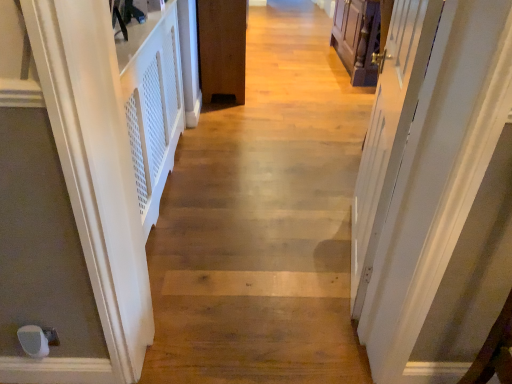
Question: Can you confirm if brown matte door at center, which appears as the second door when viewed from the front, is bigger than white matte door at left, marked as the second door in a back-to-front arrangement?

Choices:
 (A) yes
 (B) no

Answer: (A)

Question: Is the position of brown matte door at center, the first door positioned from the back, more distant than that of white matte door at left, the 2th door positioned from the right?

Choices:
 (A) yes
 (B) no

Answer: (A)

Question: From the image's perspective, is brown matte door at center, which appears as the second door when viewed from the front, under white matte door at left, the 1th door viewed from the left?

Choices:
 (A) no
 (B) yes

Answer: (A)

Question: Is brown matte door at center, the first door positioned from the back, next to white matte door at left, placed as the first door when sorted from front to back?

Choices:
 (A) no
 (B) yes

Answer: (A)

Question: Does brown matte door at center, the first door when ordered from right to left, have a greater width compared to white matte door at left, marked as the second door in a back-to-front arrangement?

Choices:
 (A) no
 (B) yes

Answer: (B)

Question: Is brown matte door at center, the first door positioned from the back, inside the boundaries of natural wood floor at center, or outside?

Choices:
 (A) inside
 (B) outside

Answer: (B)

Question: In terms of height, does brown matte door at center, the first door when ordered from right to left, look taller or shorter compared to natural wood floor at center?

Choices:
 (A) tall
 (B) short

Answer: (A)

Question: Is brown matte door at center, which appears as the second door when viewed from the front, to the left or to the right of natural wood floor at center in the image?

Choices:
 (A) right
 (B) left

Answer: (B)

Question: In the image, is brown matte door at center, the 2th door when ordered from left to right, positioned in front of or behind natural wood floor at center?

Choices:
 (A) front
 (B) behind

Answer: (B)

Question: Is white glossy door at right inside or outside of brown matte door at center, the 2th door when ordered from left to right?

Choices:
 (A) inside
 (B) outside

Answer: (B)

Question: In the image, is white glossy door at right on the left side or the right side of brown matte door at center, the first door when ordered from right to left?

Choices:
 (A) right
 (B) left

Answer: (A)

Question: Is white glossy door at right taller or shorter than brown matte door at center, which appears as the second door when viewed from the front?

Choices:
 (A) tall
 (B) short

Answer: (A)

Question: Is point (379, 142) positioned closer to the camera than point (233, 97)?

Choices:
 (A) closer
 (B) farther

Answer: (A)

Question: Is natural wood floor at center bigger or smaller than white matte door at left, placed as the first door when sorted from front to back?

Choices:
 (A) small
 (B) big

Answer: (B)

Question: Do you think natural wood floor at center is within white matte door at left, the 1th door viewed from the left, or outside of it?

Choices:
 (A) inside
 (B) outside

Answer: (B)